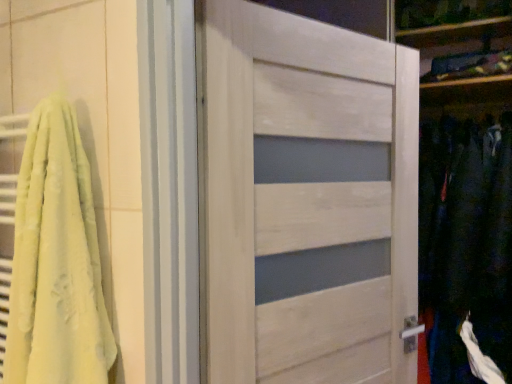
Question: Is point (14, 278) positioned closer to the camera than point (244, 251)?

Choices:
 (A) farther
 (B) closer

Answer: (B)

Question: Visually, is soft yellow towel at left positioned to the left or to the right of white wood door at center?

Choices:
 (A) right
 (B) left

Answer: (B)

Question: Which object is the closest to the soft yellow towel at left?

Choices:
 (A) white wood door at center
 (B) dark blue fabric at right

Answer: (A)

Question: Based on their relative distances, which object is farther from the dark blue fabric at right?

Choices:
 (A) soft yellow towel at left
 (B) white wood door at center

Answer: (A)